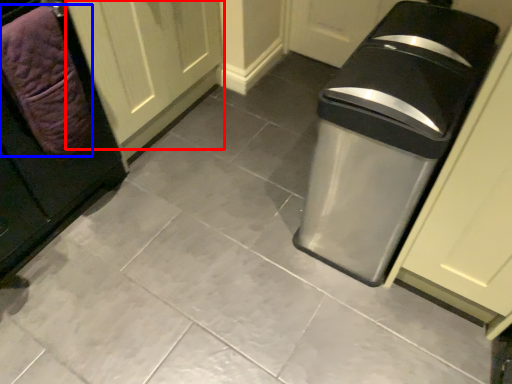
Question: Which object is closer to the camera taking this photo, door (highlighted by a red box) or blanket (highlighted by a blue box)?

Choices:
 (A) door
 (B) blanket

Answer: (B)